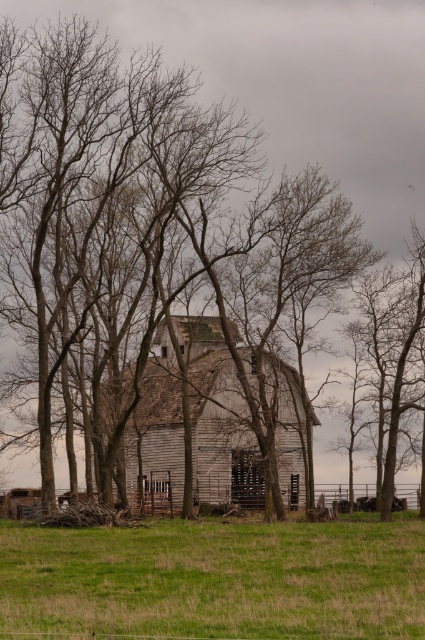
Question: Which object is closer to the camera taking this photo?

Choices:
 (A) brown wood tree at center
 (B) brown wood tree at right
 (C) green grassy field at lower center
 (D) weathered wood barn at center

Answer: (C)

Question: Is green grassy field at lower center closer to the viewer compared to brown wood tree at right?

Choices:
 (A) no
 (B) yes

Answer: (B)

Question: Which of these objects is positioned farthest from the weathered wood barn at center?

Choices:
 (A) green grassy field at lower center
 (B) brown wood tree at center
 (C) brown wood tree at right

Answer: (A)

Question: Which point appears farthest from the camera in this image?

Choices:
 (A) (379, 492)
 (B) (299, 502)
 (C) (175, 182)

Answer: (A)

Question: Is brown wood tree at center closer to the viewer compared to brown wood tree at right?

Choices:
 (A) no
 (B) yes

Answer: (B)

Question: Is the position of green grassy field at lower center more distant than that of brown wood tree at right?

Choices:
 (A) yes
 (B) no

Answer: (B)